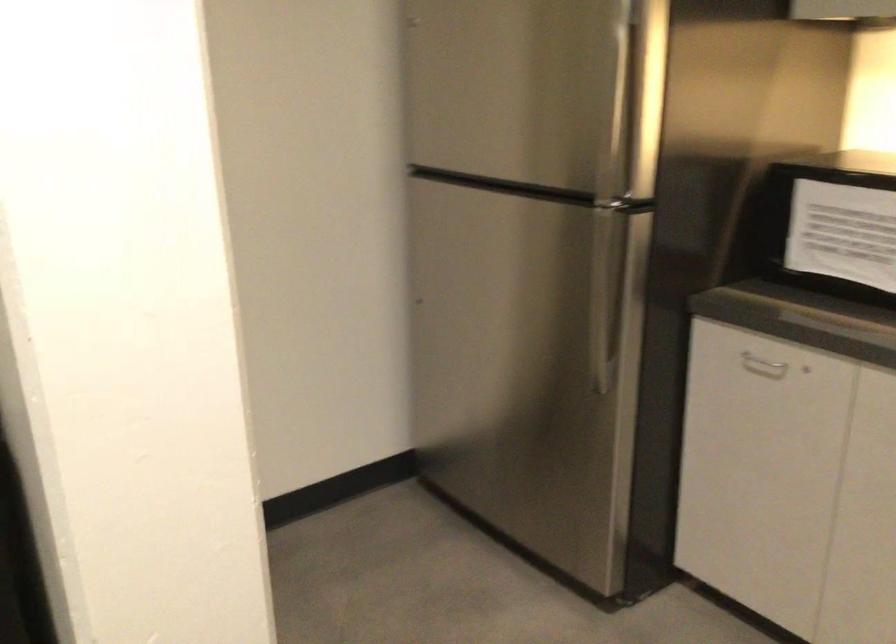
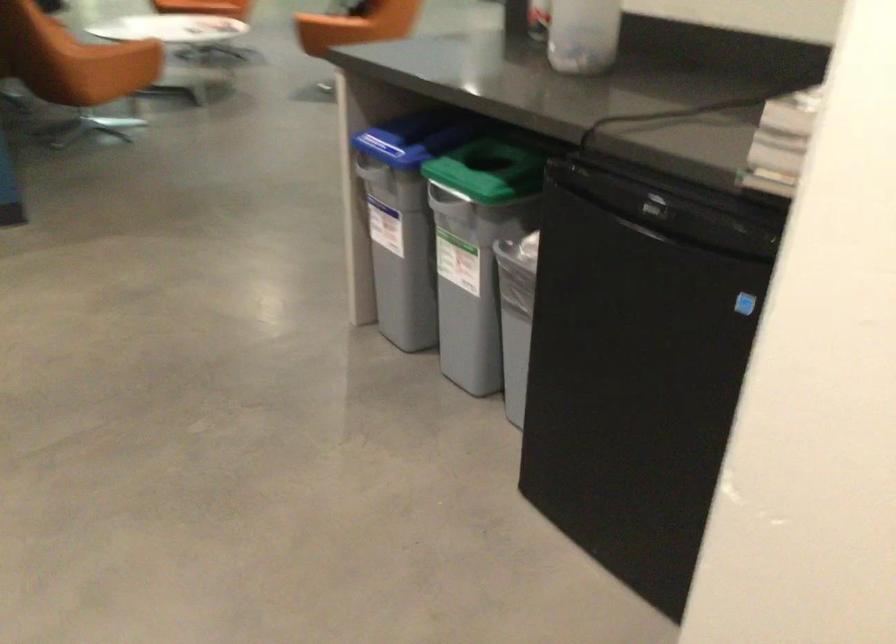
Looking at this image, how did the camera likely rotate?

The rotation direction of the camera is left-down.